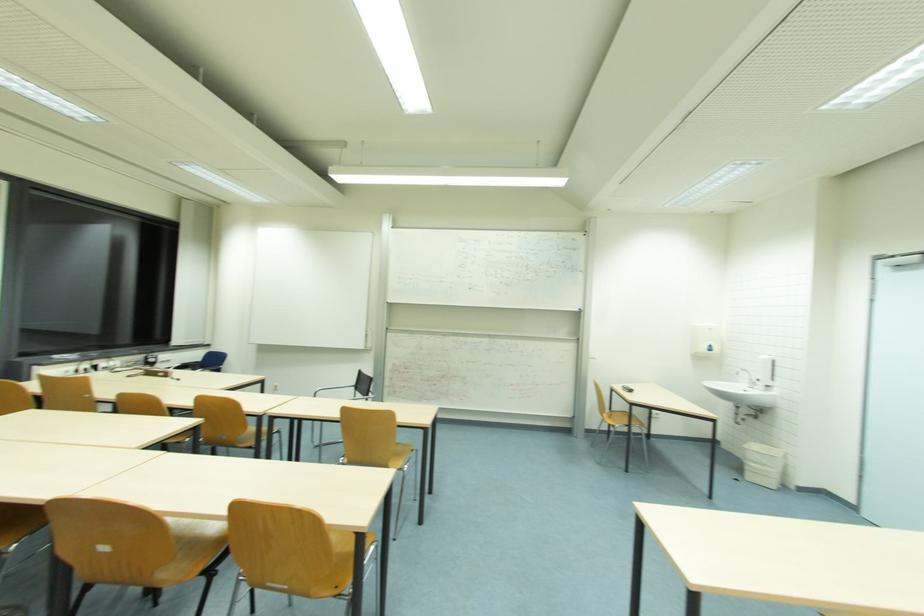
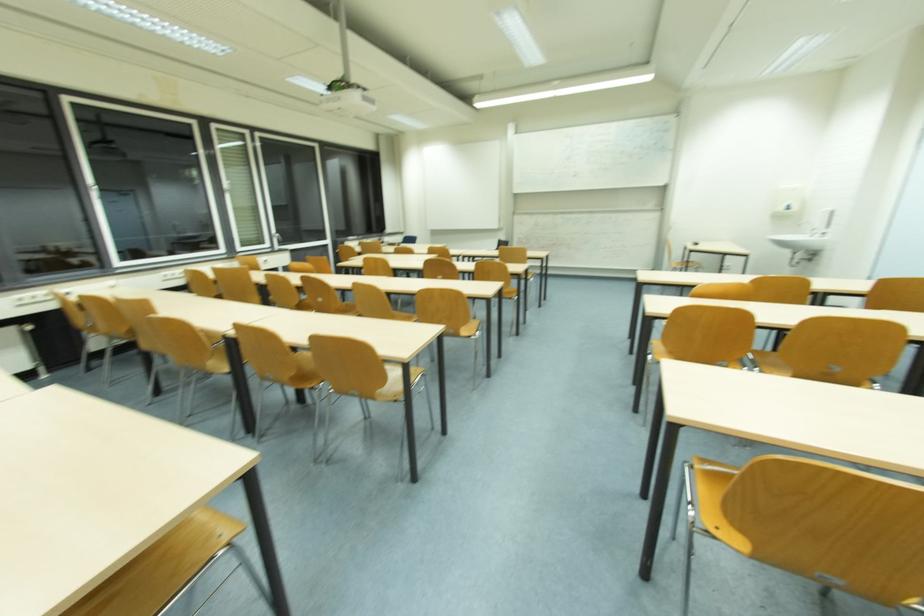
Question: What movement of the cameraman would produce the second image?

Choices:
 (A) Left
 (B) Right
 (C) Forward
 (D) Backward

Answer: (D)